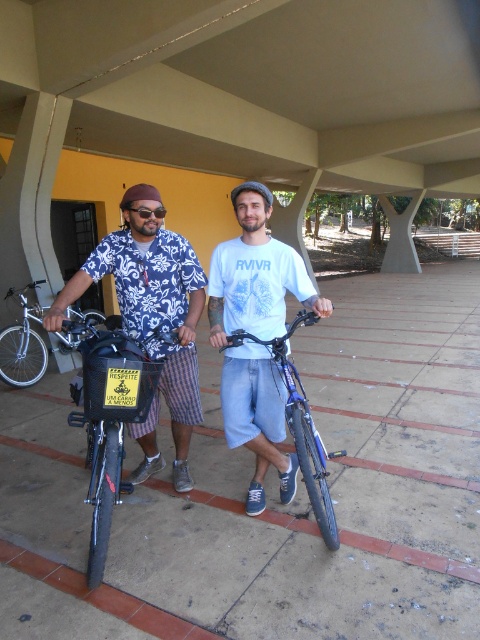
You are planning to place the silver metallic bicycle at left and the transparent plastic goggles at center into a storage box. The box can only accommodate one of them. Which object should you choose based on their sizes?

The silver metallic bicycle at left is bigger than transparent plastic goggles at center, so you should choose the transparent plastic goggles at center to fit into the storage box.

You are standing in the parking area and want to reach a point that is exactly 7.70 feet away from you. Can you confirm if the point at coordinates point (103, 541) is the correct location to reach?

Yes, the point at coordinates point (103, 541) is exactly 7.70 feet away from you, so it is the correct location to reach.